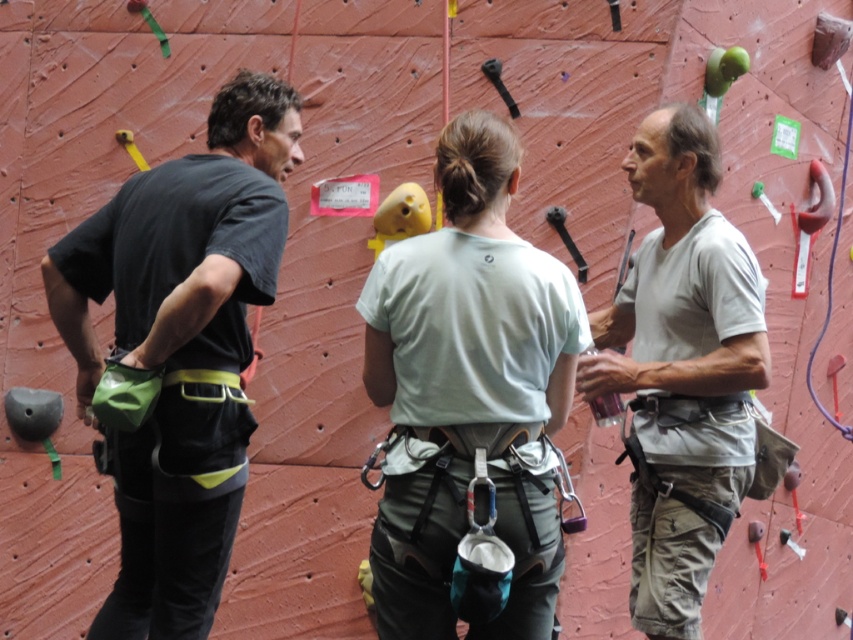
Which is more to the left, light green fabric shirt at center or gray cotton shirt at center?

Positioned to the left is light green fabric shirt at center.

Is light green fabric shirt at center taller than gray cotton shirt at center?

Incorrect, light green fabric shirt at center's height is not larger of gray cotton shirt at center's.

At what (x,y) coordinates should I click in order to perform the action: click on light green fabric shirt at center. Please return your answer as a coordinate pair (x, y). The width and height of the screenshot is (853, 640). Looking at the image, I should click on (468, 390).

Find the location of a particular element. This screenshot has height=640, width=853. light green fabric shirt at center is located at coordinates (468, 390).

Which is in front, point (84, 244) or point (672, 312)?

Point (84, 244)

Is green fabric climbing harness at left positioned in front of gray cotton shirt at center?

That is True.

What are the coordinates of `green fabric climbing harness at left` in the screenshot? It's located at (180, 348).

Measure the distance between green fabric climbing harness at left and camera.

6.17 meters

Is green fabric climbing harness at left above light green fabric shirt at center?

Correct, green fabric climbing harness at left is located above light green fabric shirt at center.

Image resolution: width=853 pixels, height=640 pixels. In order to click on green fabric climbing harness at left in this screenshot , I will do `click(180, 348)`.